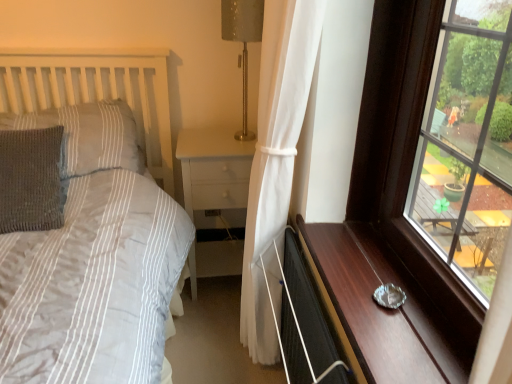
Question: Is metallic silver ashtray at right situated inside transparent glass window at right or outside?

Choices:
 (A) outside
 (B) inside

Answer: (A)

Question: Does point (375, 256) appear closer or farther from the camera than point (488, 240)?

Choices:
 (A) closer
 (B) farther

Answer: (B)

Question: Considering the real-world distances, which object is closest to the transparent glass window at right?

Choices:
 (A) gray knitted pillow at left, which is counted as the 1th pillow, starting from the bottom
 (B) white glossy nightstand at center
 (C) knitted gray pillow at left, positioned as the 1th pillow in top-to-bottom order
 (D) metallic gray table lamp at upper center
 (E) white sheer curtain at center

Answer: (E)

Question: Which object is positioned closest to the white sheer curtain at center?

Choices:
 (A) black matte screen door at lower right
 (B) transparent glass window at right
 (C) metallic gray table lamp at upper center
 (D) gray knitted pillow at left, the 2th pillow from the top
 (E) knitted gray pillow at left, positioned as the 1th pillow in top-to-bottom order

Answer: (A)